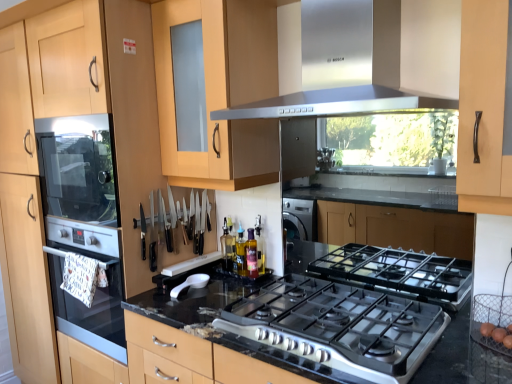
Question: Would you say white plastic spoon at center contains black granite countertop at center?

Choices:
 (A) yes
 (B) no

Answer: (B)

Question: Is white plastic spoon at center further to camera compared to black granite countertop at center?

Choices:
 (A) no
 (B) yes

Answer: (B)

Question: Can you confirm if white plastic spoon at center is shorter than black granite countertop at center?

Choices:
 (A) yes
 (B) no

Answer: (A)

Question: From the image's perspective, does white plastic spoon at center appear lower than black granite countertop at center?

Choices:
 (A) yes
 (B) no

Answer: (B)

Question: Is white plastic spoon at center positioned beyond the bounds of black granite countertop at center?

Choices:
 (A) yes
 (B) no

Answer: (A)

Question: Is white plastic spoon at center turned away from black granite countertop at center?

Choices:
 (A) yes
 (B) no

Answer: (B)

Question: Does white plastic spoon at center appear on the left side of translucent glass bottle at center, placed as the 1th bottle when sorted from right to left?

Choices:
 (A) yes
 (B) no

Answer: (A)

Question: Does white plastic spoon at center have a smaller size compared to translucent glass bottle at center, which is counted as the first bottle, starting from the front?

Choices:
 (A) no
 (B) yes

Answer: (A)

Question: Is white plastic spoon at center at the right side of translucent glass bottle at center, placed as the 1th bottle when sorted from right to left?

Choices:
 (A) no
 (B) yes

Answer: (A)

Question: Can you confirm if white plastic spoon at center is taller than translucent glass bottle at center, placed as the 1th bottle when sorted from right to left?

Choices:
 (A) yes
 (B) no

Answer: (B)

Question: Is translucent glass bottle at center, which is counted as the first bottle, starting from the front, at the back of white plastic spoon at center?

Choices:
 (A) no
 (B) yes

Answer: (A)

Question: Is translucent glass bottle at center, which is the second bottle in back-to-front order, inside white plastic spoon at center?

Choices:
 (A) no
 (B) yes

Answer: (A)

Question: From the image's perspective, is stainless steel range hood at upper center under translucent glass bottle at center, the first bottle when ordered from left to right?

Choices:
 (A) yes
 (B) no

Answer: (B)